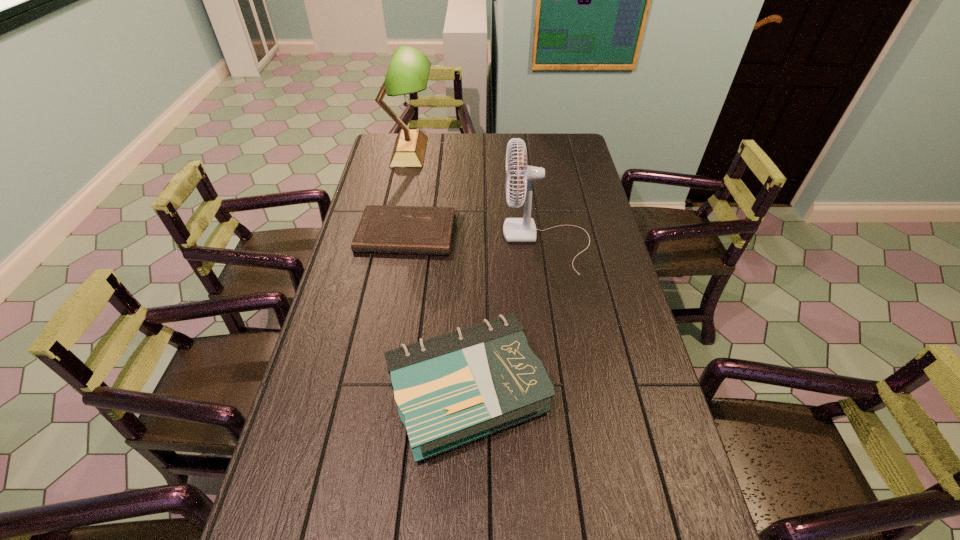
This screenshot has height=540, width=960. Find the location of `free space at the far left corner`. free space at the far left corner is located at coordinates (378, 152).

Identify the location of free space at the far right corner. (548, 148).

Find the location of a particular element. The height and width of the screenshot is (540, 960). free space that is in between the third shortest object and the shortest object is located at coordinates (476, 238).

The height and width of the screenshot is (540, 960). Find the location of `vacant point located between the farthest object and the shortest object`. vacant point located between the farthest object and the shortest object is located at coordinates (408, 192).

This screenshot has width=960, height=540. I want to click on blank region between the table lamp and the farther paperback book, so click(x=408, y=192).

Locate an element on the screen. The image size is (960, 540). vacant space that's between the farthest object and the fan is located at coordinates (478, 197).

At what (x,y) coordinates should I click in order to perform the action: click on free spot between the table lamp and the shorter paperback book. Please return your answer as a coordinate pair (x, y). Looking at the image, I should click on (408, 192).

Find the location of `vacant area that lies between the farthest object and the shortest object`. vacant area that lies between the farthest object and the shortest object is located at coordinates (408, 192).

I want to click on vacant space that is in between the third shortest object and the table lamp, so click(478, 197).

This screenshot has width=960, height=540. Find the location of `vacant area that lies between the farthest object and the second tallest object`. vacant area that lies between the farthest object and the second tallest object is located at coordinates (478, 197).